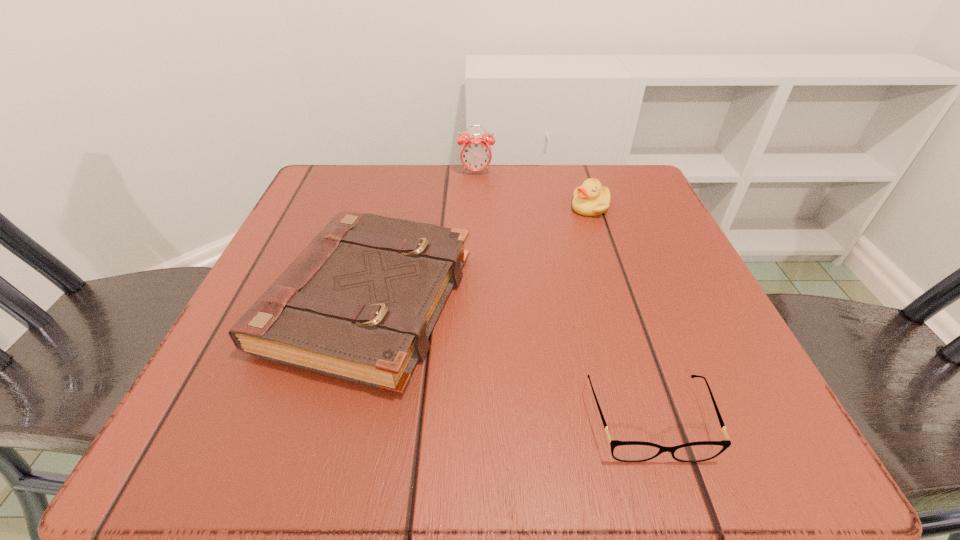
Image resolution: width=960 pixels, height=540 pixels. In order to click on the farthest object in this screenshot , I will do `click(475, 153)`.

The image size is (960, 540). Identify the location of the tallest object. (475, 153).

This screenshot has height=540, width=960. I want to click on hardback book, so click(359, 303).

Where is `the second farthest object`? This screenshot has height=540, width=960. the second farthest object is located at coordinates (590, 199).

Where is `spectacles`? The height and width of the screenshot is (540, 960). spectacles is located at coordinates (625, 451).

At what (x,y) coordinates should I click in order to perform the action: click on free location located 0.330m on the face of the tallest object. Please return your answer as a coordinate pair (x, y). Looking at the image, I should click on (475, 272).

Where is `blank space located 0.210m on the right of the hardback book`? This screenshot has height=540, width=960. blank space located 0.210m on the right of the hardback book is located at coordinates (600, 302).

Find the location of a particular element. The image size is (960, 540). free spot located on the front-facing side of the second farthest object is located at coordinates (459, 207).

In order to click on free space located on the front-facing side of the second farthest object in this screenshot , I will do `click(508, 207)`.

Locate an element on the screen. free space located on the front-facing side of the second farthest object is located at coordinates (429, 207).